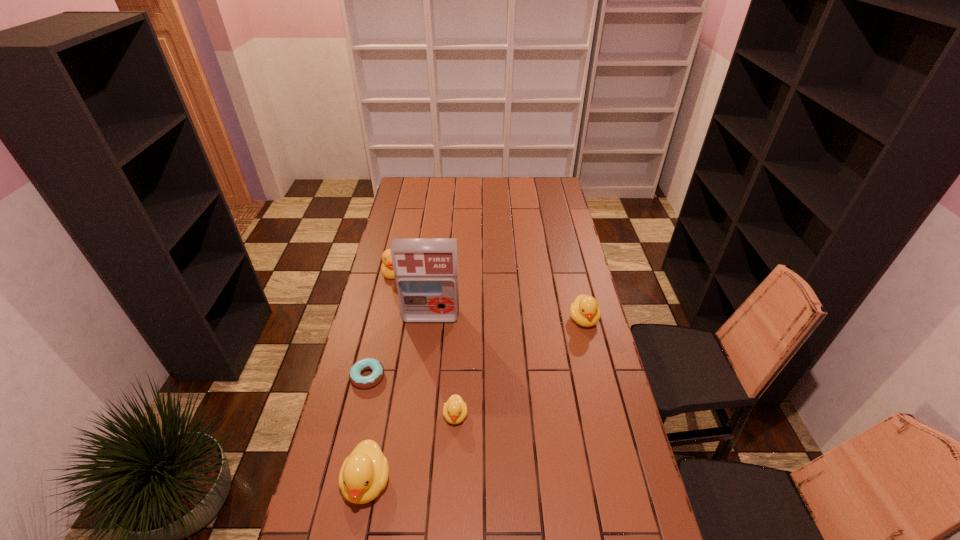
Locate an element on the screen. This screenshot has width=960, height=540. the leftmost duckling is located at coordinates point(364,473).

Locate an element on the screen. This screenshot has height=540, width=960. the nearest duckling is located at coordinates (364, 473).

Where is `the fifth tallest object`? The image size is (960, 540). the fifth tallest object is located at coordinates (455, 409).

Locate an element on the screen. The height and width of the screenshot is (540, 960). the second duckling from right to left is located at coordinates (455, 409).

At what (x,y) coordinates should I click in order to perform the action: click on the rightmost object. Please return your answer as a coordinate pair (x, y). Looking at the image, I should click on (584, 310).

Identify the location of the second shortest duckling. This screenshot has width=960, height=540. (584, 310).

Locate an element on the screen. This screenshot has width=960, height=540. the farthest object is located at coordinates (387, 270).

Locate an element on the screen. the third nearest object is located at coordinates (356, 378).

Identify the location of doughnut. (356, 378).

What are the coordinates of `the first-aid kit` in the screenshot? It's located at (426, 270).